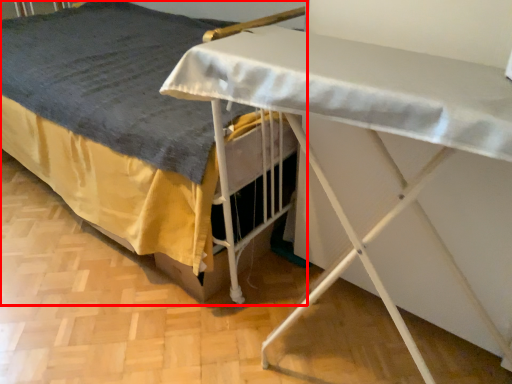
Question: Considering the relative positions of bed (annotated by the red box) and table in the image provided, where is bed (annotated by the red box) located with respect to the staircase?

Choices:
 (A) right
 (B) left

Answer: (B)